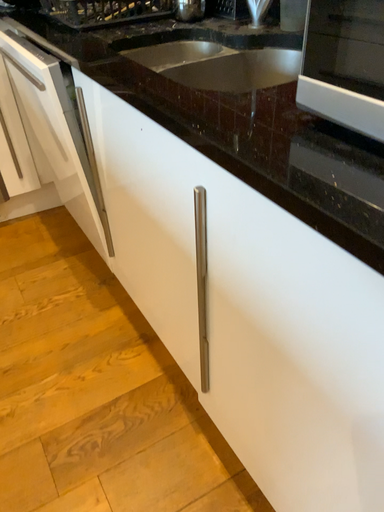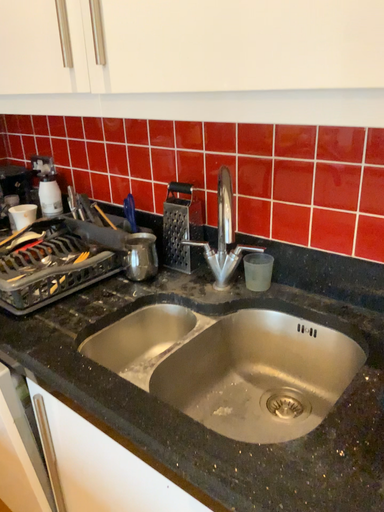
Question: How did the camera likely rotate when shooting the video?

Choices:
 (A) rotated downward
 (B) rotated upward

Answer: (B)